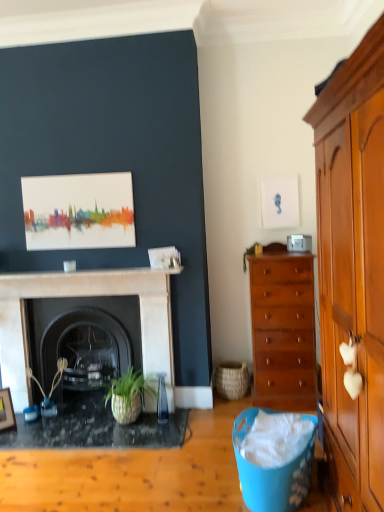
Question: From the image's perspective, is green leafy plant at center-right, the first plant from the right, located beneath black marble fireplace at center, the 1th fireplace when ordered from back to front?

Choices:
 (A) no
 (B) yes

Answer: (A)

Question: Is green leafy plant at center-right, the first plant positioned from the top, aimed at black marble fireplace at center, arranged as the 2th fireplace when viewed from the front?

Choices:
 (A) yes
 (B) no

Answer: (B)

Question: From a real-world perspective, is green leafy plant at center-right, the second plant viewed from the left, below black marble fireplace at center, the 1th fireplace when ordered from back to front?

Choices:
 (A) no
 (B) yes

Answer: (A)

Question: From a real-world perspective, is green leafy plant at center-right, the second plant viewed from the left, on top of black marble fireplace at center, the 1th fireplace when ordered from back to front?

Choices:
 (A) yes
 (B) no

Answer: (A)

Question: From the image's perspective, is green leafy plant at center-right, the first plant from the right, over black marble fireplace at center, the 1th fireplace when ordered from back to front?

Choices:
 (A) yes
 (B) no

Answer: (A)

Question: Is green leafy plant at center-right, the 2th plant in the bottom-to-top sequence, positioned in front of black marble fireplace at center, the 1th fireplace when ordered from back to front?

Choices:
 (A) yes
 (B) no

Answer: (B)

Question: Is black marble fireplace at center, arranged as the 2th fireplace when viewed from the front, facing towards black marble fireplace at center, which is the 1th fireplace in front-to-back order?

Choices:
 (A) no
 (B) yes

Answer: (B)

Question: From the image's perspective, is black marble fireplace at center, the 1th fireplace when ordered from back to front, located above black marble fireplace at center, which is the 1th fireplace in front-to-back order?

Choices:
 (A) yes
 (B) no

Answer: (B)

Question: Can you confirm if black marble fireplace at center, arranged as the 2th fireplace when viewed from the front, is shorter than black marble fireplace at center, which is the 1th fireplace in front-to-back order?

Choices:
 (A) yes
 (B) no

Answer: (A)

Question: Is black marble fireplace at center, arranged as the 2th fireplace when viewed from the front, turned away from black marble fireplace at center, the second fireplace positioned from the back?

Choices:
 (A) no
 (B) yes

Answer: (B)

Question: Can you confirm if black marble fireplace at center, arranged as the 2th fireplace when viewed from the front, is taller than black marble fireplace at center, which is the 1th fireplace in front-to-back order?

Choices:
 (A) yes
 (B) no

Answer: (B)

Question: Can you see black marble fireplace at center, the 1th fireplace when ordered from back to front, touching black marble fireplace at center, which is the 1th fireplace in front-to-back order?

Choices:
 (A) no
 (B) yes

Answer: (A)

Question: Is green leafy plant at center-right, the first plant positioned from the top, facing away from black marble fireplace at center, the second fireplace positioned from the back?

Choices:
 (A) yes
 (B) no

Answer: (B)